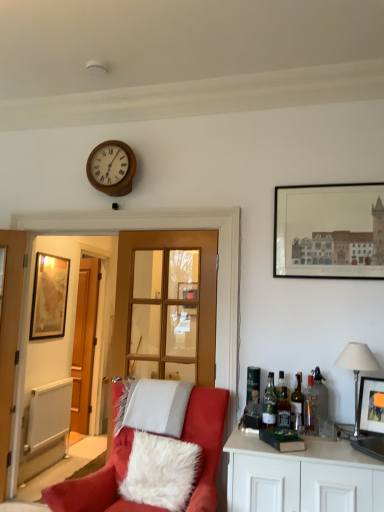
Question: Is white fluffy pillow at lower center, the second pillow from the back, positioned with its back to clear glass door at center?

Choices:
 (A) no
 (B) yes

Answer: (B)

Question: From the image's perspective, is white fluffy pillow at lower center, acting as the first pillow starting from the front, below clear glass door at center?

Choices:
 (A) no
 (B) yes

Answer: (B)

Question: Is white fluffy pillow at lower center, acting as the first pillow starting from the front, positioned in front of clear glass door at center?

Choices:
 (A) yes
 (B) no

Answer: (A)

Question: Can you confirm if white fluffy pillow at lower center, acting as the first pillow starting from the front, is smaller than clear glass door at center?

Choices:
 (A) yes
 (B) no

Answer: (A)

Question: Considering the relative sizes of white fluffy pillow at lower center, acting as the first pillow starting from the front, and clear glass door at center in the image provided, is white fluffy pillow at lower center, acting as the first pillow starting from the front, shorter than clear glass door at center?

Choices:
 (A) no
 (B) yes

Answer: (B)

Question: Would you say suede red chair at lower left is to the left or to the right of white fluffy pillow at lower center, acting as the first pillow starting from the front, in the picture?

Choices:
 (A) left
 (B) right

Answer: (A)

Question: Is suede red chair at lower left wider or thinner than white fluffy pillow at lower center, the second pillow from the back?

Choices:
 (A) wide
 (B) thin

Answer: (A)

Question: Is point (127, 505) closer or farther from the camera than point (173, 441)?

Choices:
 (A) farther
 (B) closer

Answer: (B)

Question: Is suede red chair at lower left in front of or behind white fluffy pillow at lower center, the second pillow from the back, in the image?

Choices:
 (A) behind
 (B) front

Answer: (B)

Question: In terms of width, does green glass bottle at right, the 3th bottle from the left, look wider or thinner when compared to clear glass bottle at right, which is counted as the 1th bottle, starting from the right?

Choices:
 (A) thin
 (B) wide

Answer: (B)

Question: Relative to clear glass bottle at right, which ranks as the sixth bottle in left-to-right order, is green glass bottle at right, the 3th bottle from the left, in front or behind?

Choices:
 (A) behind
 (B) front

Answer: (B)

Question: From the image's perspective, is green glass bottle at right, which is counted as the 4th bottle, starting from the right, positioned above or below clear glass bottle at right, which is counted as the 1th bottle, starting from the right?

Choices:
 (A) above
 (B) below

Answer: (B)

Question: Considering the relative positions of green glass bottle at right, the 3th bottle from the left, and clear glass bottle at right, which is counted as the 1th bottle, starting from the right, in the image provided, is green glass bottle at right, the 3th bottle from the left, to the left or to the right of clear glass bottle at right, which is counted as the 1th bottle, starting from the right,?

Choices:
 (A) right
 (B) left

Answer: (B)

Question: Considering the relative positions of silver metallic lampshade at right and translucent glass bottle at right, the 4th bottle from the left, in the image provided, is silver metallic lampshade at right to the left or to the right of translucent glass bottle at right, the 4th bottle from the left,?

Choices:
 (A) left
 (B) right

Answer: (B)

Question: Considering the positions of silver metallic lampshade at right and translucent glass bottle at right, the 3th bottle from the right, in the image, is silver metallic lampshade at right wider or thinner than translucent glass bottle at right, the 3th bottle from the right,?

Choices:
 (A) wide
 (B) thin

Answer: (A)